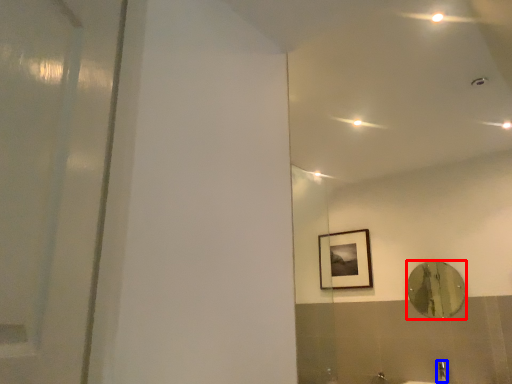
Question: Which object is further to the camera taking this photo, mirror (highlighted by a red box) or faucet (highlighted by a blue box)?

Choices:
 (A) mirror
 (B) faucet

Answer: (A)